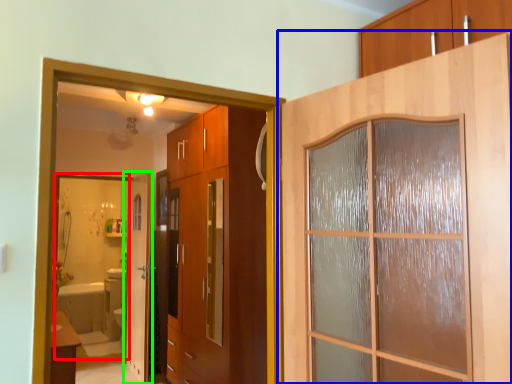
Question: Which is nearer to the mirror (highlighted by a red box)? door (highlighted by a blue box) or door (highlighted by a green box).

Choices:
 (A) door
 (B) door

Answer: (B)